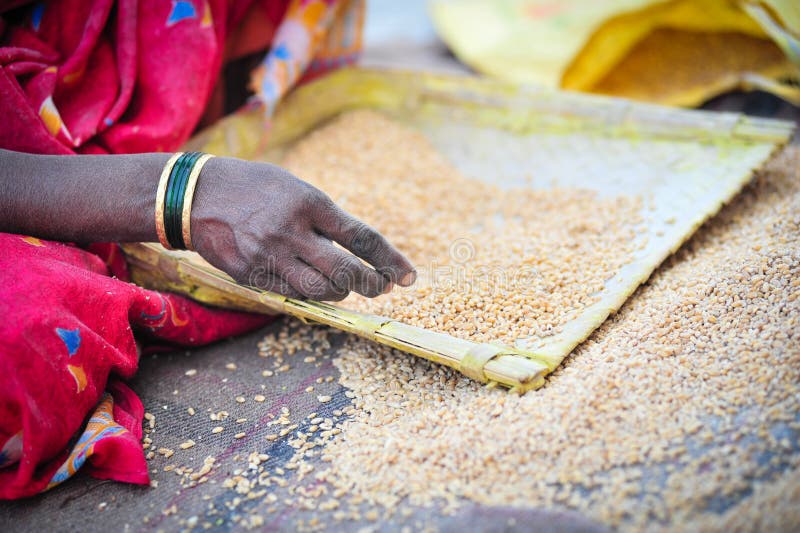
Locate an element on the screen. The height and width of the screenshot is (533, 800). grayish green tray is located at coordinates (622, 158).